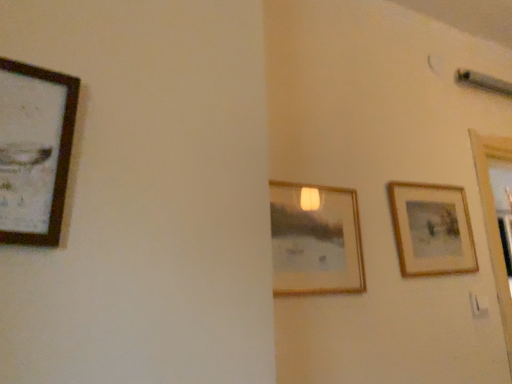
Question: Considering the positions of wooden framed artwork at left, acting as the 1th picture frame starting from the left, and wooden framed picture at right, positioned as the 3th picture frame in front-to-back order, in the image, is wooden framed artwork at left, acting as the 1th picture frame starting from the left, bigger or smaller than wooden framed picture at right, positioned as the 3th picture frame in front-to-back order,?

Choices:
 (A) small
 (B) big

Answer: (B)

Question: Which is correct: wooden framed artwork at left, the 3th picture frame viewed from the back, is inside wooden framed picture at right, positioned as the third picture frame in left-to-right order, or outside of it?

Choices:
 (A) outside
 (B) inside

Answer: (A)

Question: Considering the real-world distances, which object is closest to the wooden framed artwork at left, the 3th picture frame viewed from the back?

Choices:
 (A) wooden framed picture at center, arranged as the 2th picture frame when viewed from the right
 (B) wooden framed picture at right, which appears as the first picture frame when viewed from the right

Answer: (A)

Question: Which of these objects is positioned farthest from the wooden framed picture at center, positioned as the second picture frame in back-to-front order?

Choices:
 (A) wooden framed artwork at left, acting as the 1th picture frame starting from the left
 (B) wooden framed picture at right, which appears as the first picture frame when viewed from the right

Answer: (A)